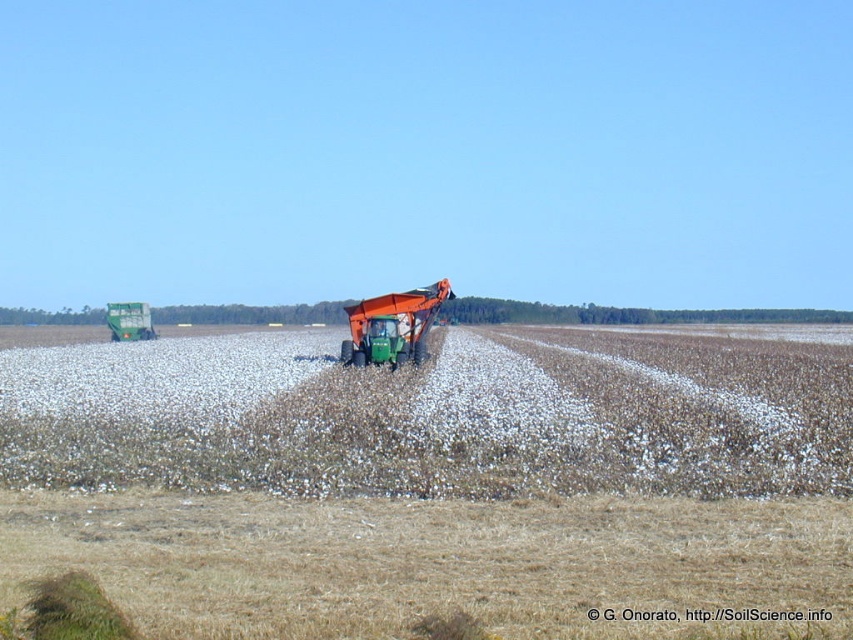
Which is more to the right, white fluffy cotton at center or green plastic tractor at center?

From the viewer's perspective, white fluffy cotton at center appears more on the right side.

Who is positioned more to the left, white fluffy cotton at center or green plastic tractor at center?

From the viewer's perspective, green plastic tractor at center appears more on the left side.

Who is more forward, [114,497] or [410,301]?

Point [114,497]

Locate an element on the screen. The image size is (853, 640). white fluffy cotton at center is located at coordinates (433, 477).

Who is higher up, green plastic tractor at center or green matte tractor at center?

green matte tractor at center is higher up.

From the picture: Can you confirm if green plastic tractor at center is wider than green matte tractor at center?

No.

You are a GUI agent. You are given a task and a screenshot of the screen. Output one action in this format:
    pyautogui.click(x=<x>, y=<y>)
    Task: Click on the green plastic tractor at center
    This screenshot has height=640, width=853.
    Given the screenshot: What is the action you would take?
    pyautogui.click(x=392, y=326)

Identify the location of green plastic tractor at center. The height and width of the screenshot is (640, 853). (392, 326).

Is white fluffy cotton at center smaller than green matte tractor at center?

Yes, white fluffy cotton at center is smaller than green matte tractor at center.

This screenshot has width=853, height=640. Find the location of `white fluffy cotton at center`. white fluffy cotton at center is located at coordinates (433, 477).

Where is `white fluffy cotton at center`? The width and height of the screenshot is (853, 640). white fluffy cotton at center is located at coordinates (433, 477).